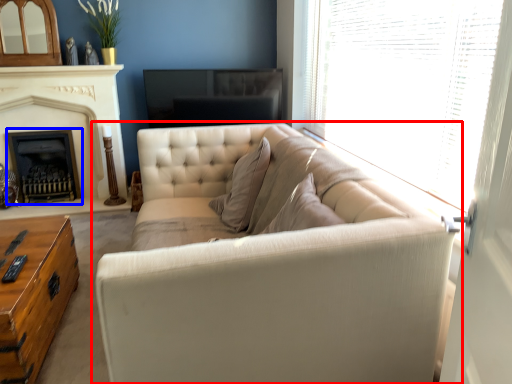
Question: Which point is closer to the camera, studio couch (highlighted by a red box) or fireplace (highlighted by a blue box)?

Choices:
 (A) studio couch
 (B) fireplace

Answer: (A)